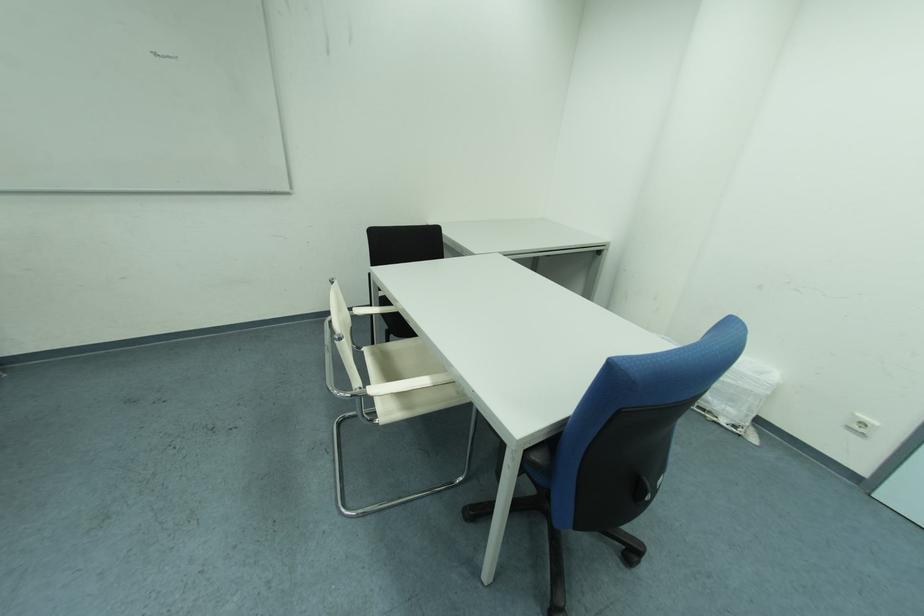
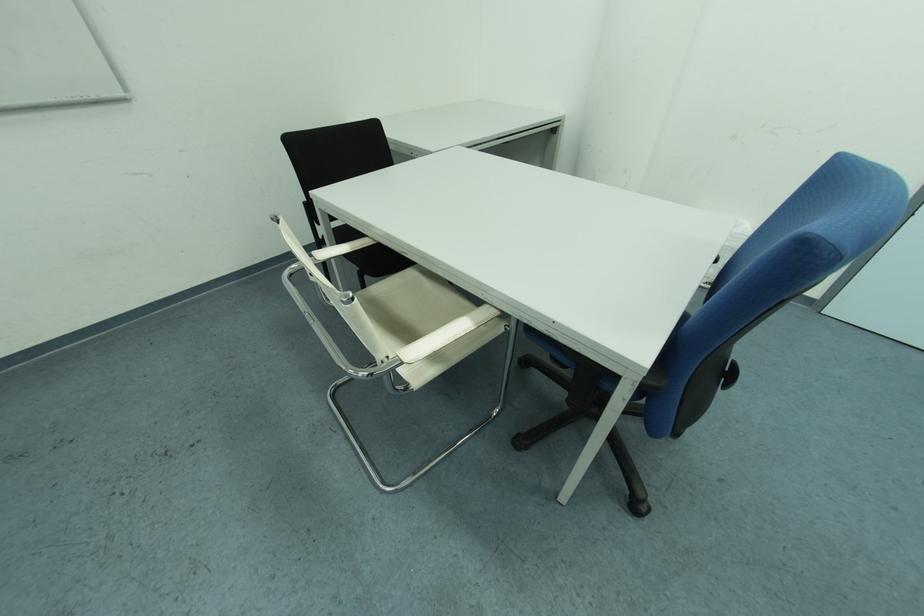
The images are taken continuously from a first-person perspective. In which direction are you moving?

The cameraman moved toward left, forward.